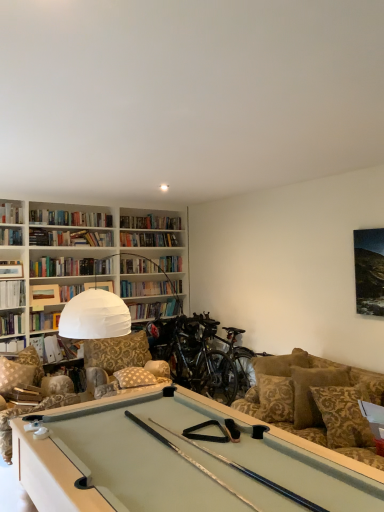
Question: Which direction should I rotate to face patterned fabric pillow at center, the first pillow when ordered from left to right, — up or down?

Choices:
 (A) down
 (B) up

Answer: (A)

Question: From the image's perspective, does camouflage fabric swivel chair at lower left appear higher than hardcover book at left, which ranks as the 3th book in bottom-to-top order?

Choices:
 (A) yes
 (B) no

Answer: (B)

Question: Is camouflage fabric swivel chair at lower left positioned before hardcover book at left, placed as the 3th book when sorted from top to bottom?

Choices:
 (A) yes
 (B) no

Answer: (A)

Question: Does camouflage fabric swivel chair at lower left appear on the left side of hardcover book at left, which ranks as the 3th book in bottom-to-top order?

Choices:
 (A) no
 (B) yes

Answer: (A)

Question: Is camouflage fabric swivel chair at lower left shorter than hardcover book at left, placed as the 3th book when sorted from top to bottom?

Choices:
 (A) no
 (B) yes

Answer: (A)

Question: Does camouflage fabric swivel chair at lower left come behind hardcover book at left, which ranks as the 3th book in bottom-to-top order?

Choices:
 (A) yes
 (B) no

Answer: (B)

Question: Is camouflage fabric swivel chair at lower left oriented towards hardcover book at left, which ranks as the 3th book in bottom-to-top order?

Choices:
 (A) no
 (B) yes

Answer: (A)

Question: Can you confirm if matte white book at upper left, placed as the fourth book when sorted from top to bottom, is shorter than hardcover book at upper left, the second book viewed from the top?

Choices:
 (A) yes
 (B) no

Answer: (B)

Question: Does matte white book at upper left, placed as the fourth book when sorted from top to bottom, have a greater width compared to hardcover book at upper left, the second book viewed from the top?

Choices:
 (A) no
 (B) yes

Answer: (B)

Question: From a real-world perspective, is matte white book at upper left, placed as the fourth book when sorted from top to bottom, physically above hardcover book at upper left, the fourth book positioned from the bottom?

Choices:
 (A) yes
 (B) no

Answer: (B)

Question: Is matte white book at upper left, positioned as the 2th book in bottom-to-top order, in contact with hardcover book at upper left, the second book viewed from the top?

Choices:
 (A) yes
 (B) no

Answer: (B)

Question: From the image's perspective, is matte white book at upper left, positioned as the 2th book in bottom-to-top order, above hardcover book at upper left, the second book viewed from the top?

Choices:
 (A) no
 (B) yes

Answer: (A)

Question: Would you consider matte white book at upper left, positioned as the 2th book in bottom-to-top order, to be distant from hardcover book at upper left, the second book viewed from the top?

Choices:
 (A) no
 (B) yes

Answer: (A)

Question: Would you say camouflage fabric swivel chair at lower left is outside shiny black mountain bike at center, placed as the first mountain bike when sorted from left to right?

Choices:
 (A) yes
 (B) no

Answer: (A)